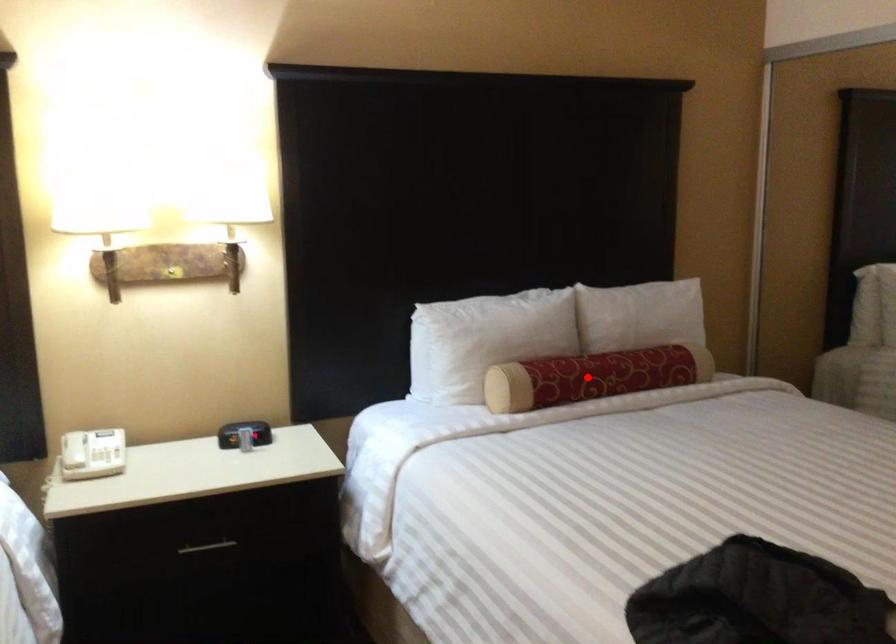
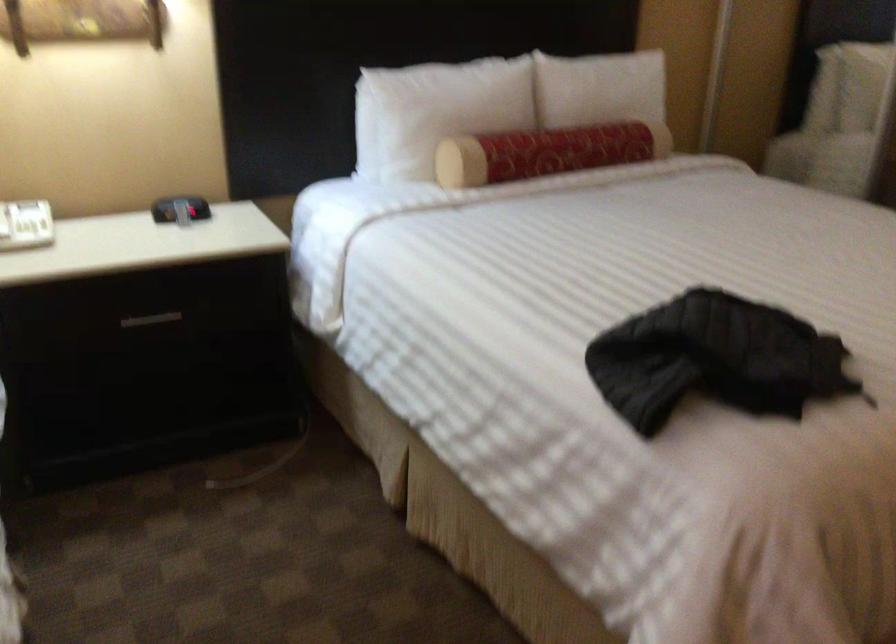
The point at the highlighted location is marked in the first image. Where is the corresponding point in the second image?

(546, 152)